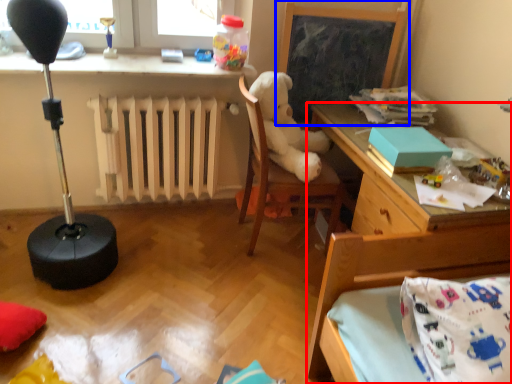
Question: Which object is further to the camera taking this photo, desk (highlighted by a red box) or bulletin board (highlighted by a blue box)?

Choices:
 (A) desk
 (B) bulletin board

Answer: (B)